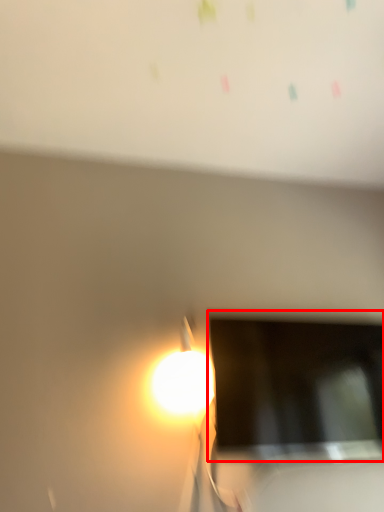
Question: Where is computer screen (annotated by the red box) located in relation to bulletin board in the image?

Choices:
 (A) right
 (B) left

Answer: (A)